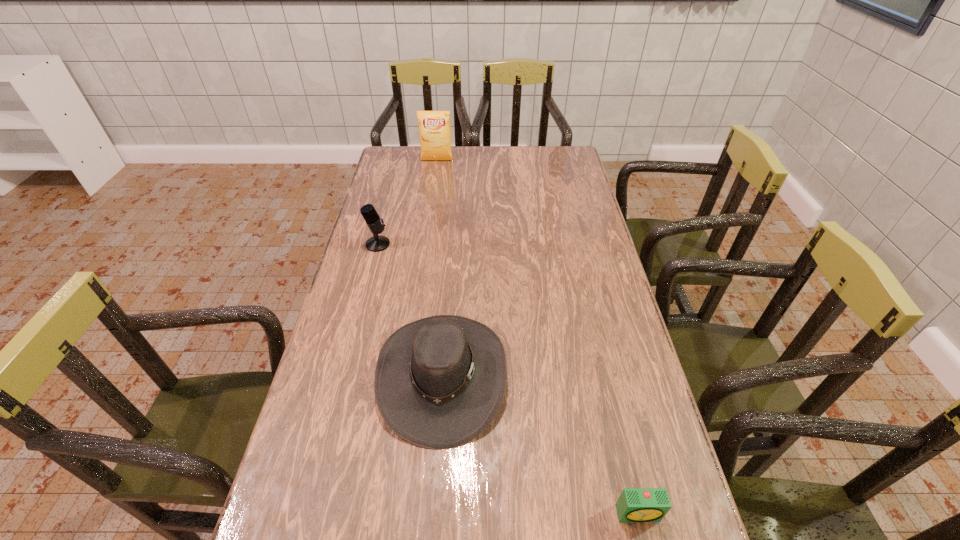
Where is `object at the far edge`? The image size is (960, 540). object at the far edge is located at coordinates (434, 126).

Where is `crisp (potato chip) situated at the left edge`? crisp (potato chip) situated at the left edge is located at coordinates (434, 126).

You are a GUI agent. You are given a task and a screenshot of the screen. Output one action in this format:
    pyautogui.click(x=<x>, y=<y>)
    Task: Click on the microphone present at the left edge
    
    Given the screenshot: What is the action you would take?
    pyautogui.click(x=377, y=243)

At what (x,y) coordinates should I click in order to perform the action: click on cowboy hat that is at the left edge. Please return your answer as a coordinate pair (x, y). Looking at the image, I should click on (439, 382).

Locate an element on the screen. The width and height of the screenshot is (960, 540). object that is positioned at the right edge is located at coordinates (634, 504).

The image size is (960, 540). I want to click on object located in the far left corner section of the desktop, so click(x=434, y=126).

In the image, there is a desktop. At what (x,y) coordinates should I click in order to perform the action: click on vacant space at the far edge. Please return your answer as a coordinate pair (x, y). This screenshot has height=540, width=960. Looking at the image, I should click on (489, 170).

I want to click on blank area at the left edge, so click(x=333, y=347).

Locate an element on the screen. The width and height of the screenshot is (960, 540). vacant point at the right edge is located at coordinates (580, 234).

Identify the location of vacant space at the far left corner of the desktop. (420, 163).